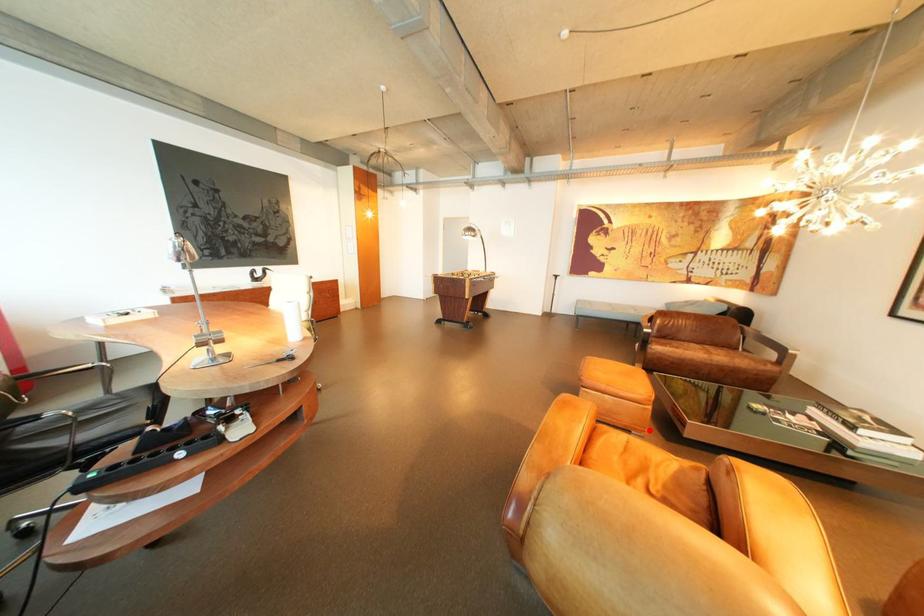
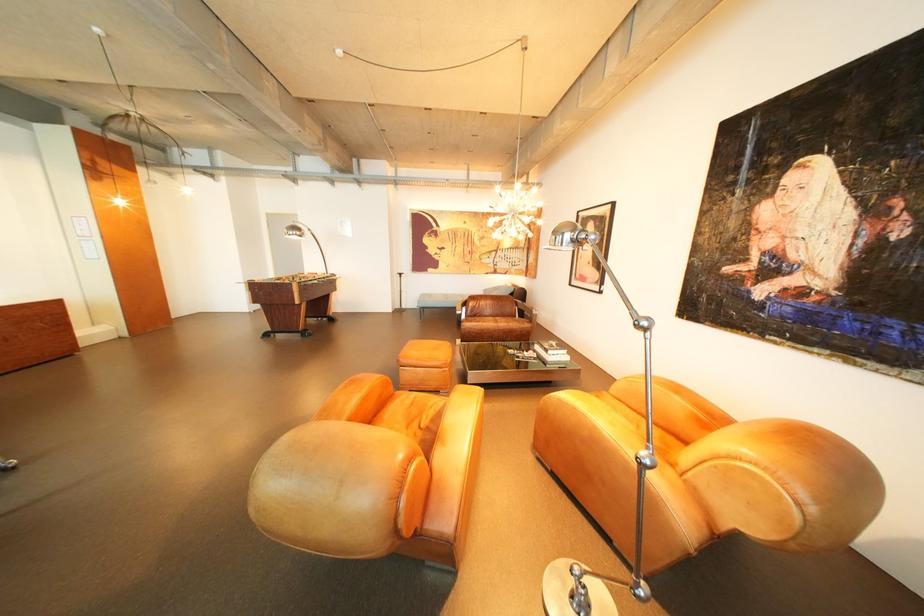
Question: I am providing you with two images of the same scene from different viewpoints. Image1 has a red point marked. In image2, the corresponding 3D location appears at what relative position? Reply with the corresponding letter.

Choices:
 (A) Closer
 (B) Farther

Answer: (A)